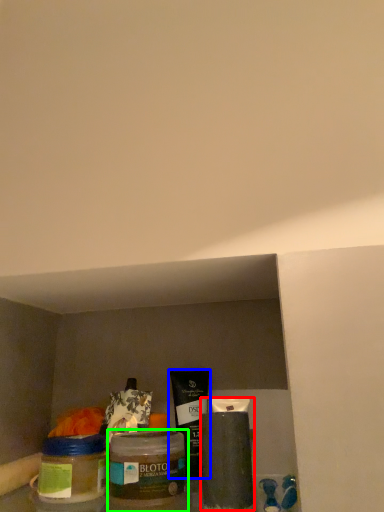
Question: Based on their relative distances, which object is farther from cleaning product (highlighted by a red box)? Choose from product (highlighted by a blue box) and glass jar (highlighted by a green box).

Choices:
 (A) product
 (B) glass jar

Answer: (B)